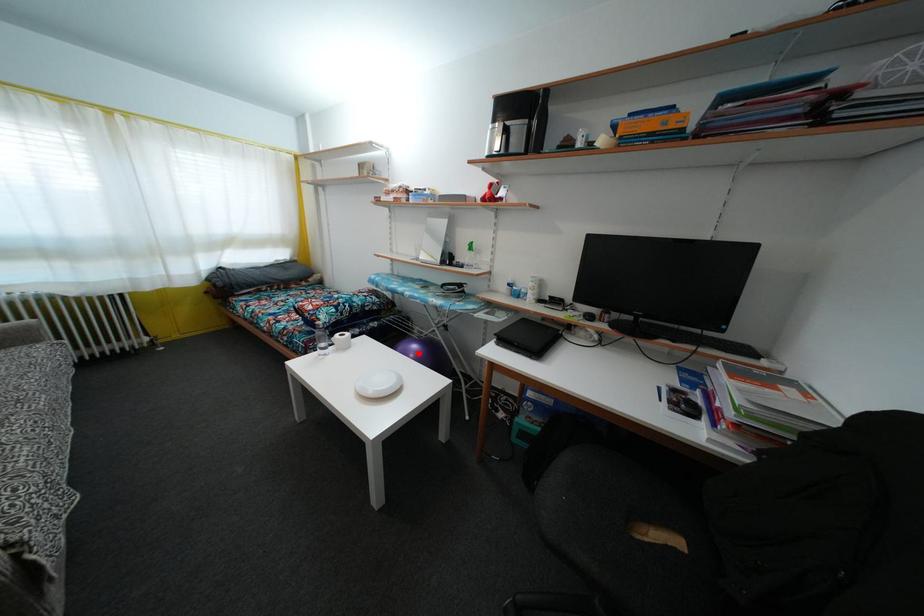
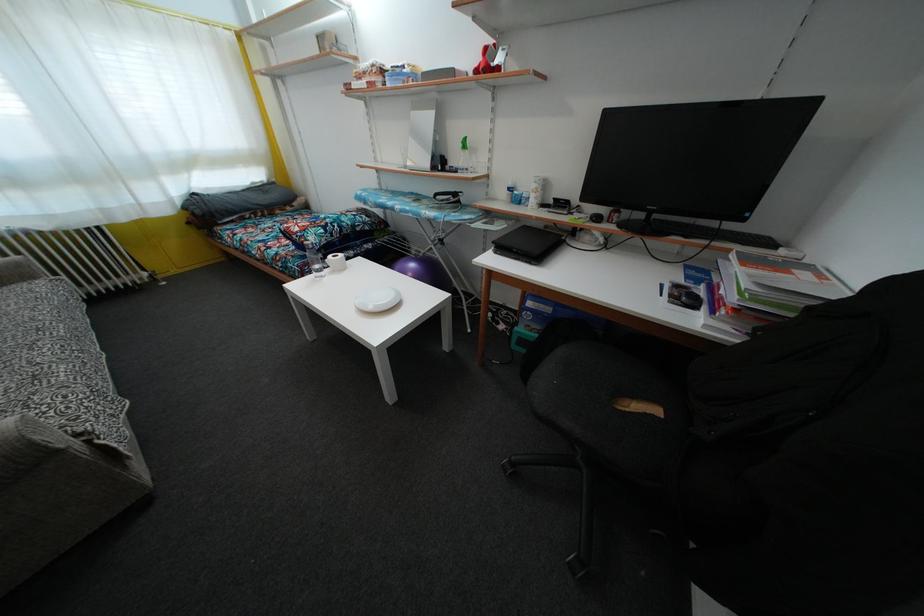
In the second image, find the point that corresponds to the highlighted location in the first image.

(416, 272)